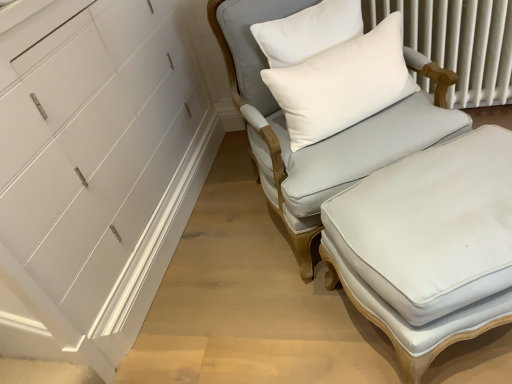
Question: From a real-world perspective, is light gray fabric chair at center positioned over white fabric ottoman at center based on gravity?

Choices:
 (A) no
 (B) yes

Answer: (B)

Question: Does light gray fabric chair at center appear on the left side of white fabric ottoman at center?

Choices:
 (A) yes
 (B) no

Answer: (A)

Question: Does light gray fabric chair at center lie behind white fabric ottoman at center?

Choices:
 (A) yes
 (B) no

Answer: (A)

Question: Is light gray fabric chair at center outside white fabric ottoman at center?

Choices:
 (A) yes
 (B) no

Answer: (A)

Question: Is light gray fabric chair at center shorter than white fabric ottoman at center?

Choices:
 (A) no
 (B) yes

Answer: (A)

Question: In terms of height, does white textured radiator at upper right look taller or shorter compared to light gray fabric chair at center?

Choices:
 (A) short
 (B) tall

Answer: (A)

Question: From the image's perspective, is white textured radiator at upper right located above or below light gray fabric chair at center?

Choices:
 (A) above
 (B) below

Answer: (A)

Question: Does point (460, 94) appear closer or farther from the camera than point (312, 0)?

Choices:
 (A) farther
 (B) closer

Answer: (A)

Question: Is white textured radiator at upper right spatially inside light gray fabric chair at center, or outside of it?

Choices:
 (A) inside
 (B) outside

Answer: (B)

Question: Looking at their shapes, would you say light gray fabric chair at center is wider or thinner than white textured radiator at upper right?

Choices:
 (A) thin
 (B) wide

Answer: (B)

Question: In terms of size, does light gray fabric chair at center appear bigger or smaller than white textured radiator at upper right?

Choices:
 (A) big
 (B) small

Answer: (A)

Question: Would you say light gray fabric chair at center is to the left or to the right of white textured radiator at upper right in the picture?

Choices:
 (A) right
 (B) left

Answer: (B)

Question: From a real-world perspective, is light gray fabric chair at center above or below white textured radiator at upper right?

Choices:
 (A) below
 (B) above

Answer: (B)

Question: In the image, is white soft cushion at upper right positioned in front of or behind light gray fabric chair at center?

Choices:
 (A) front
 (B) behind

Answer: (B)

Question: Is white soft cushion at upper right inside or outside of light gray fabric chair at center?

Choices:
 (A) inside
 (B) outside

Answer: (A)